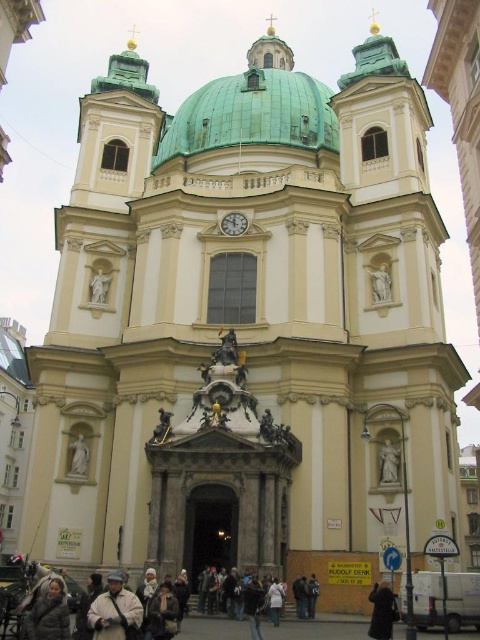
You are an architect analyzing the symmetry of the church facade. Given the placement of the green copper dome at upper center and the white marble statue at upper left, which one is located more to the right side of the facade?

The green copper dome at upper center is positioned on the right side of the white marble statue at upper left, meaning it is more to the right on the facade.